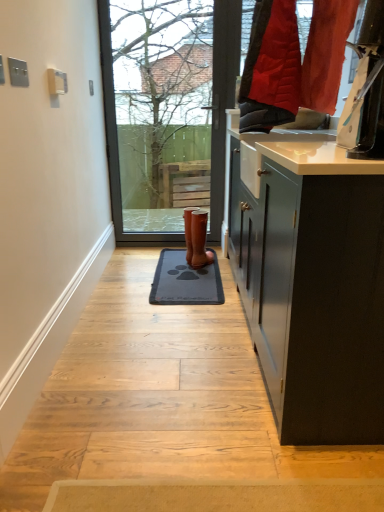
At what (x,y) coordinates should I click in order to perform the action: click on free space that is to the left of brown leather boot at center. Please return your answer as a coordinate pair (x, y). This screenshot has width=384, height=512. Looking at the image, I should click on (178, 261).